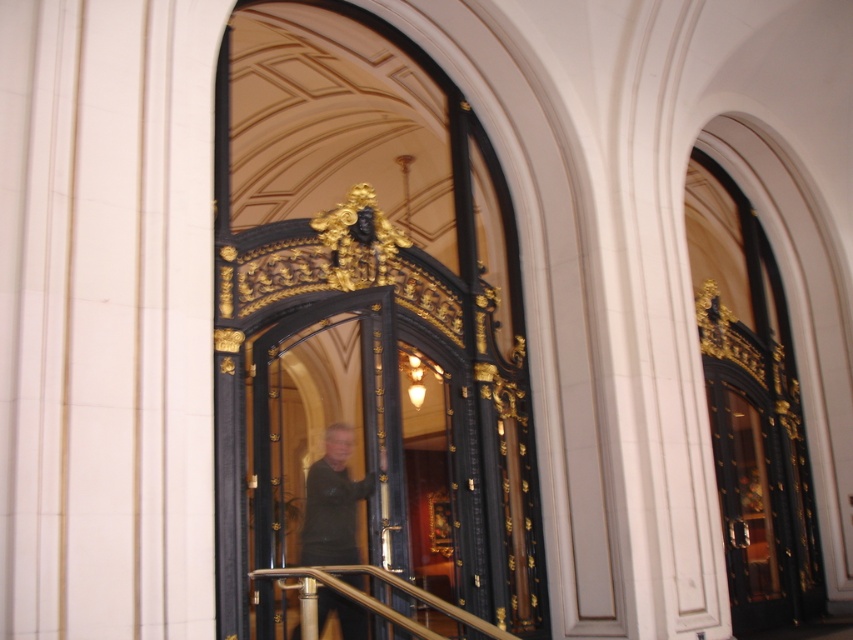
This screenshot has height=640, width=853. Describe the element at coordinates (358, 449) in the screenshot. I see `polished dark wood door at center` at that location.

Can you confirm if polished dark wood door at center is positioned to the right of polished brass railing at center?

No, polished dark wood door at center is not to the right of polished brass railing at center.

What do you see at coordinates (358, 449) in the screenshot? I see `polished dark wood door at center` at bounding box center [358, 449].

The width and height of the screenshot is (853, 640). I want to click on polished dark wood door at center, so click(358, 449).

Can you confirm if polished dark wood door at center is positioned below dark green fabric jacket at center?

Actually, polished dark wood door at center is above dark green fabric jacket at center.

Looking at this image, is polished dark wood door at center closer to camera compared to dark green fabric jacket at center?

That is False.

Does point (366, 387) come behind point (338, 422)?

Yes, point (366, 387) is farther from viewer.

Image resolution: width=853 pixels, height=640 pixels. In order to click on polished dark wood door at center in this screenshot , I will do `click(358, 449)`.

Between dark green fabric jacket at center and polished brass railing at center, which one has more height?

Standing taller between the two is dark green fabric jacket at center.

Who is higher up, dark green fabric jacket at center or polished brass railing at center?

dark green fabric jacket at center

Is point (352, 428) closer to viewer compared to point (445, 609)?

No, it is not.

The image size is (853, 640). Identify the location of dark green fabric jacket at center. (332, 502).